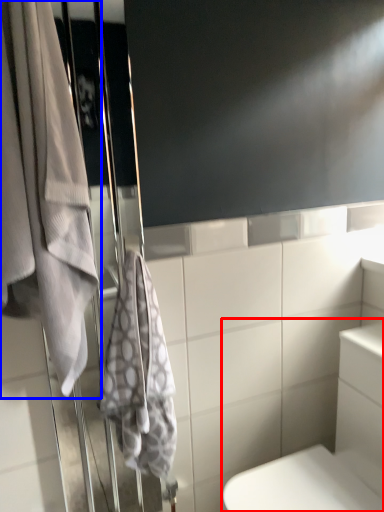
Question: Which object appears closest to the camera in this image, bath (highlighted by a red box) or towel (highlighted by a blue box)?

Choices:
 (A) bath
 (B) towel

Answer: (B)